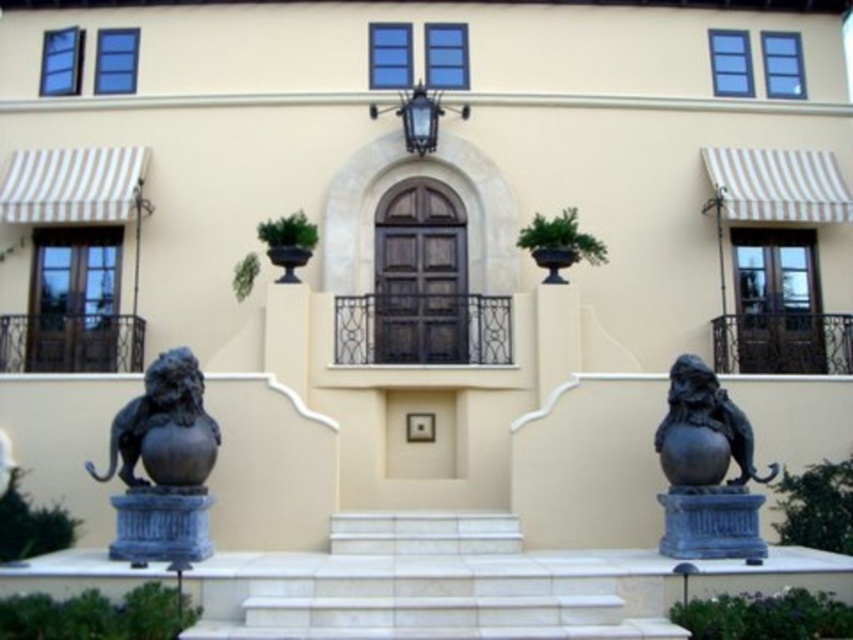
Question: Which is farther from the white marble stairs at center?

Choices:
 (A) black polished stone lion at right
 (B) bronze lion at left

Answer: (B)

Question: In this image, where is white marble stairs at center located relative to bronze lion at left?

Choices:
 (A) left
 (B) right

Answer: (B)

Question: From the image, what is the correct spatial relationship of bronze lion at left in relation to black polished stone lion at right?

Choices:
 (A) right
 (B) left

Answer: (B)

Question: Which object appears farthest from the camera in this image?

Choices:
 (A) white marble stairs at center
 (B) black polished stone lion at right
 (C) bronze lion at left

Answer: (A)

Question: Can you confirm if white marble stairs at center is thinner than bronze lion at left?

Choices:
 (A) yes
 (B) no

Answer: (A)

Question: Which point is closer to the camera?

Choices:
 (A) black polished stone lion at right
 (B) bronze lion at left

Answer: (B)